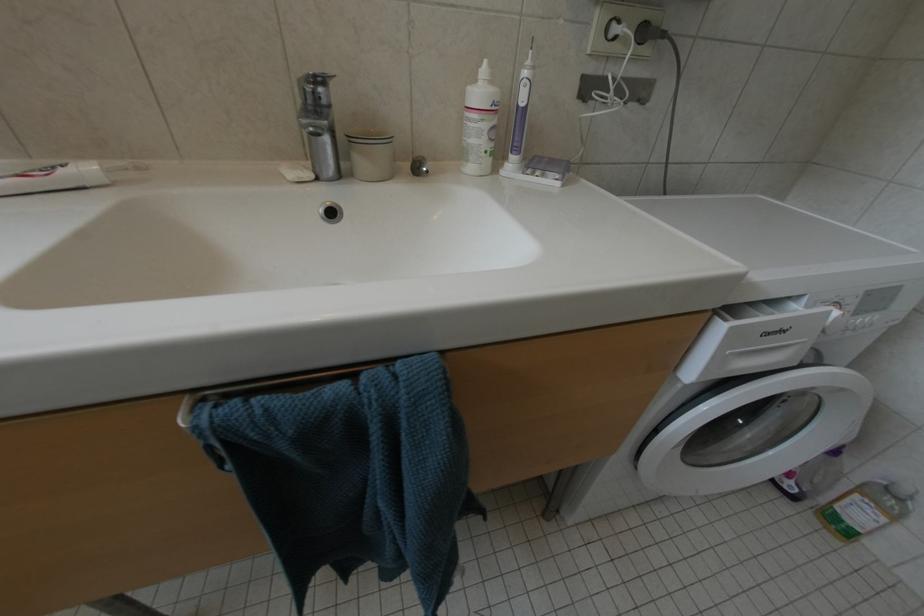
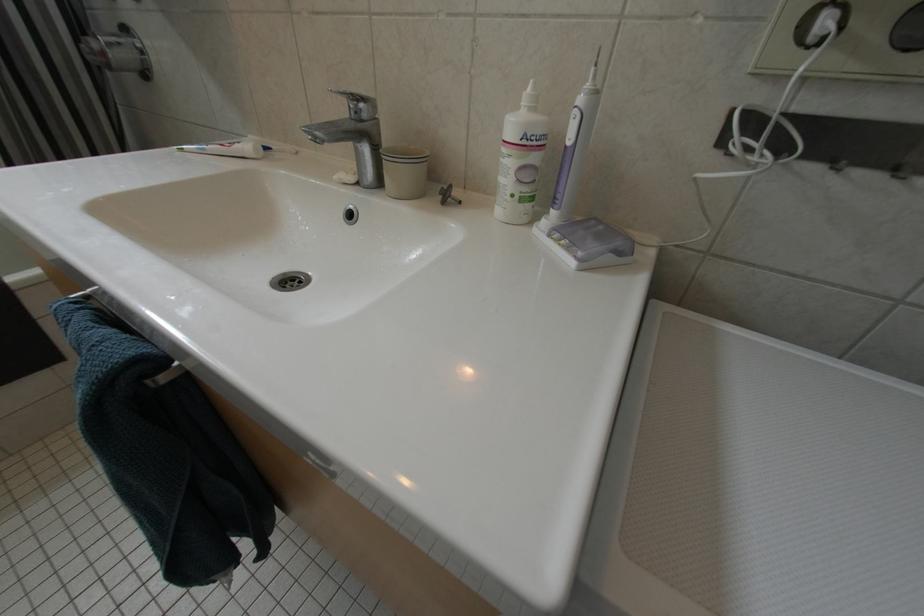
Question: The images are taken continuously from a first-person perspective. In which direction is your viewpoint rotating?

Choices:
 (A) Left
 (B) Right
 (C) Up
 (D) Down

Answer: (A)